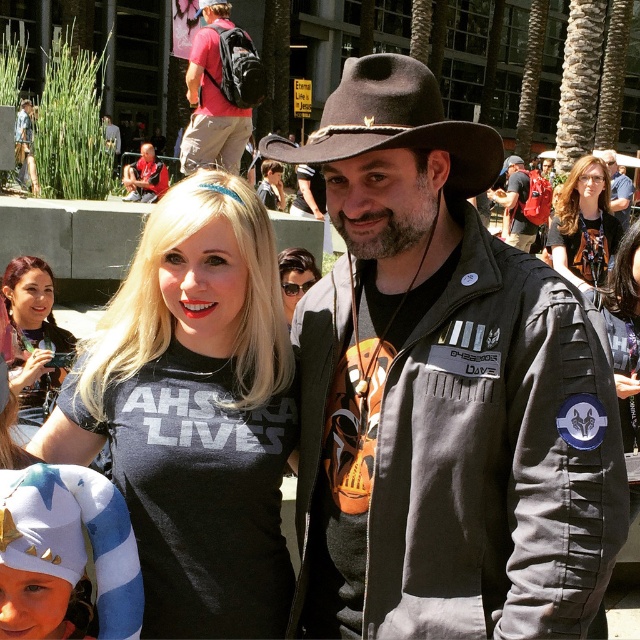
Looking at this image, can you confirm if black felt fedora at center is taller than matte red t-shirt at upper center?

No, black felt fedora at center is not taller than matte red t-shirt at upper center.

Does black felt fedora at center appear over matte red t-shirt at upper center?

Incorrect, black felt fedora at center is not positioned above matte red t-shirt at upper center.

Measure the distance between point (385, 124) and camera.

Point (385, 124) is 15.37 feet from camera.

Identify the location of black felt fedora at center. (394, 124).

Is point (84, 556) closer to viewer compared to point (310, 262)?

Yes, point (84, 556) is closer to viewer.

Does blue and white knit hat at lower left have a lesser width compared to matte black sunglasses at center?

No, blue and white knit hat at lower left is not thinner than matte black sunglasses at center.

The image size is (640, 640). What do you see at coordinates (65, 552) in the screenshot?
I see `blue and white knit hat at lower left` at bounding box center [65, 552].

This screenshot has width=640, height=640. Find the location of `blue and white knit hat at lower left`. blue and white knit hat at lower left is located at coordinates point(65,552).

Can you confirm if matte black t-shirt at center is positioned to the right of blonde hair at center?

Incorrect, matte black t-shirt at center is not on the right side of blonde hair at center.

Is point (51, 333) less distant than point (608, 250)?

Yes, it is.

Where is `matte black t-shirt at center`? matte black t-shirt at center is located at coordinates (35, 339).

Where is `matte black t-shirt at center`? This screenshot has width=640, height=640. matte black t-shirt at center is located at coordinates (35, 339).